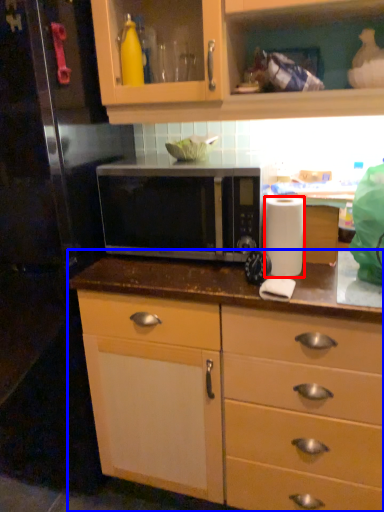
Question: Which object is further to the camera taking this photo, paper towel (highlighted by a red box) or countertop (highlighted by a blue box)?

Choices:
 (A) paper towel
 (B) countertop

Answer: (A)